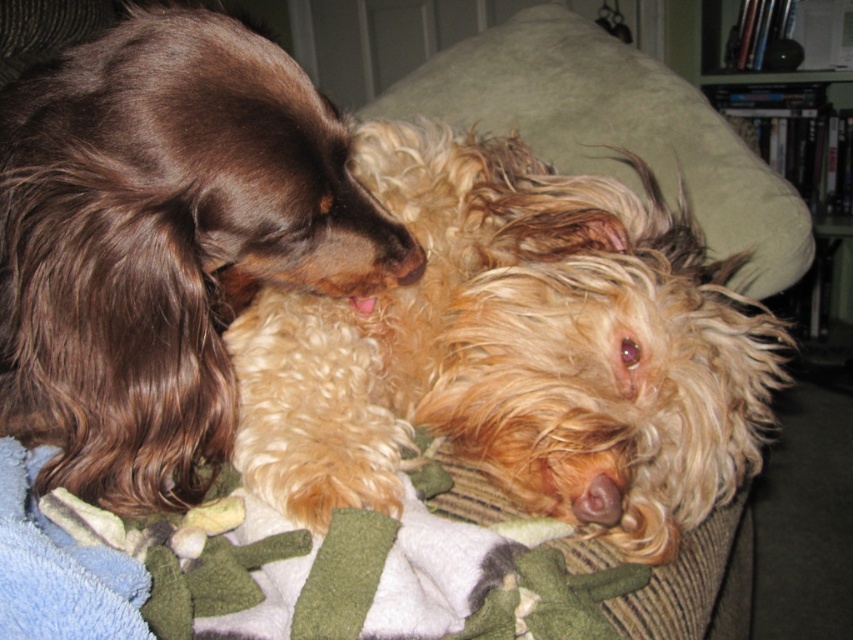
Question: Estimate the real-world distances between objects in this image. Which object is farther from the soft fleece blanket at center?

Choices:
 (A) fuzzy golden dog at center
 (B) shiny brown fur at upper left

Answer: (B)

Question: Observing the image, what is the correct spatial positioning of fuzzy golden dog at center in reference to wooden bookshelf at upper right?

Choices:
 (A) above
 (B) below

Answer: (B)

Question: Is fuzzy golden dog at center closer to camera compared to wooden bookshelf at upper right?

Choices:
 (A) yes
 (B) no

Answer: (A)

Question: Based on their relative distances, which object is nearer to the fuzzy golden dog at center?

Choices:
 (A) shiny brown fur at upper left
 (B) soft fleece blanket at center

Answer: (B)

Question: Among these objects, which one is farthest from the camera?

Choices:
 (A) wooden bookshelf at upper right
 (B) shiny brown fur at upper left
 (C) fuzzy golden dog at center

Answer: (A)

Question: Does shiny brown fur at upper left have a larger size compared to green soft pillow at upper center?

Choices:
 (A) no
 (B) yes

Answer: (A)